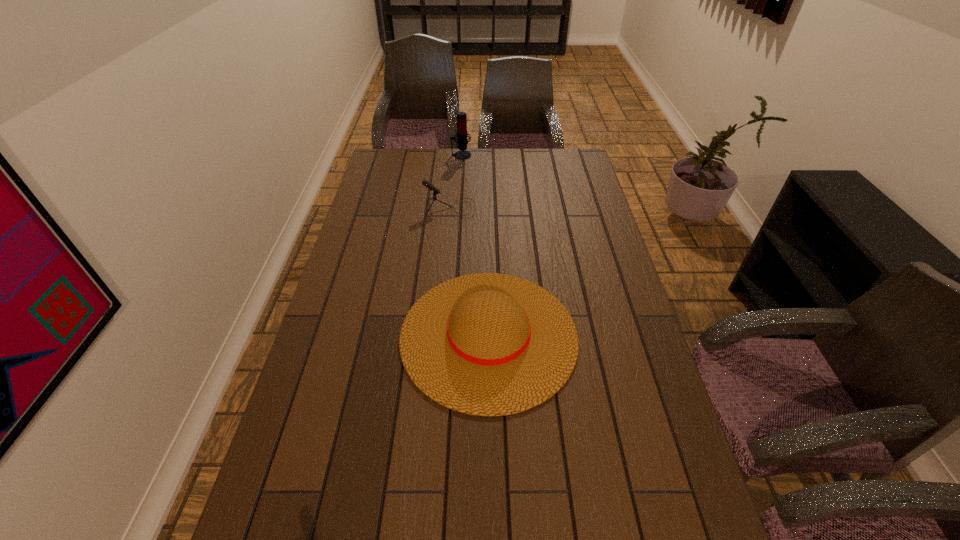
Find the location of a particular element. The height and width of the screenshot is (540, 960). free space at the left edge of the desktop is located at coordinates (369, 213).

Identify the location of vacant space at the right edge of the desktop. (605, 266).

Image resolution: width=960 pixels, height=540 pixels. Find the location of `vacant area at the far left corner of the desktop`. vacant area at the far left corner of the desktop is located at coordinates (388, 166).

Where is `free space between the nearer microphone and the farthest object`? free space between the nearer microphone and the farthest object is located at coordinates (455, 181).

Identify the location of vacant space that's between the farthest object and the bonnet. (475, 245).

Identify the location of unoccupied position between the taller microphone and the nearest object. (475, 245).

In order to click on vacant space that is in between the farther microphone and the second nearest object in this screenshot , I will do `click(455, 181)`.

What are the coordinates of `the closest object to the taller microphone` in the screenshot? It's located at (430, 186).

Locate which object is the closest to the bonnet. Please provide its 2D coordinates. Your answer should be formatted as a tuple, i.e. [(x, y)], where the tuple contains the x and y coordinates of a point satisfying the conditions above.

[(430, 186)]

You are a GUI agent. You are given a task and a screenshot of the screen. Output one action in this format:
    pyautogui.click(x=<x>, y=<y>)
    Task: Click on the second closest microphone to the nearest object
    The height and width of the screenshot is (540, 960).
    Given the screenshot: What is the action you would take?
    pyautogui.click(x=462, y=134)